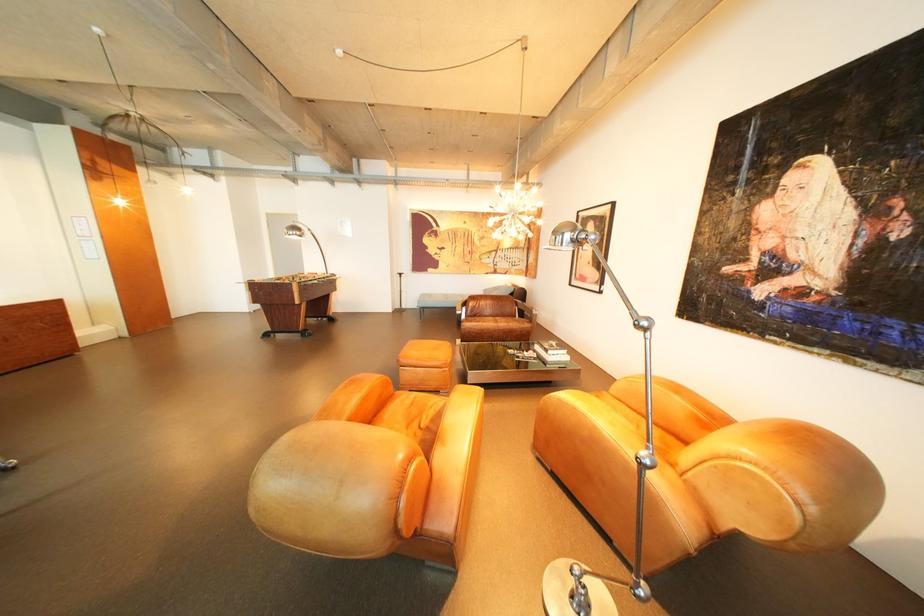
Find where to resting arm the orange leather armrest. Please return your answer as a coordinate pair (x, y).

(457, 428)